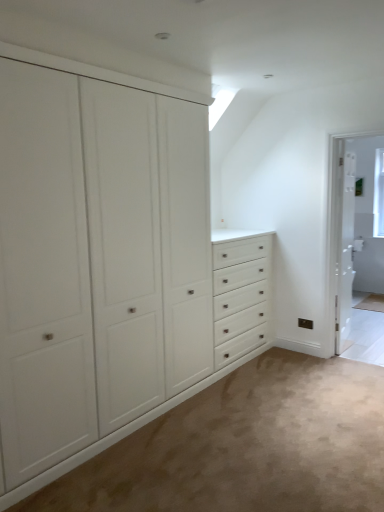
This screenshot has width=384, height=512. Find the location of `vacant region in front of white glossy door at right`. vacant region in front of white glossy door at right is located at coordinates (352, 349).